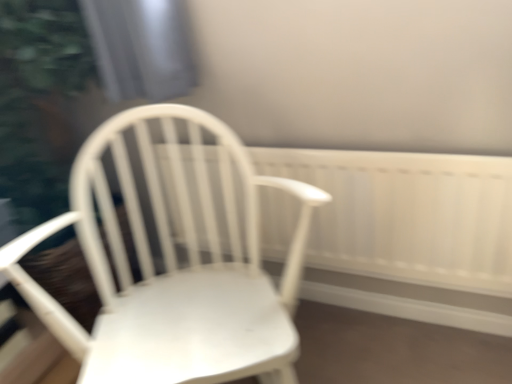
Question: Is white matte wood chair at center to the left or to the right of white wooden radiator at center in the image?

Choices:
 (A) left
 (B) right

Answer: (A)

Question: Considering the positions of white matte wood chair at center and white wooden radiator at center in the image, is white matte wood chair at center wider or thinner than white wooden radiator at center?

Choices:
 (A) wide
 (B) thin

Answer: (A)

Question: Relative to white wooden radiator at center, is white matte wood chair at center in front or behind?

Choices:
 (A) front
 (B) behind

Answer: (A)

Question: Is white wooden radiator at center in front of or behind white matte wood chair at center in the image?

Choices:
 (A) front
 (B) behind

Answer: (B)

Question: Is white wooden radiator at center wider or thinner than white matte wood chair at center?

Choices:
 (A) wide
 (B) thin

Answer: (B)

Question: From the image's perspective, is white wooden radiator at center positioned above or below white matte wood chair at center?

Choices:
 (A) below
 (B) above

Answer: (B)

Question: Is point (465, 167) closer or farther from the camera than point (268, 332)?

Choices:
 (A) closer
 (B) farther

Answer: (B)